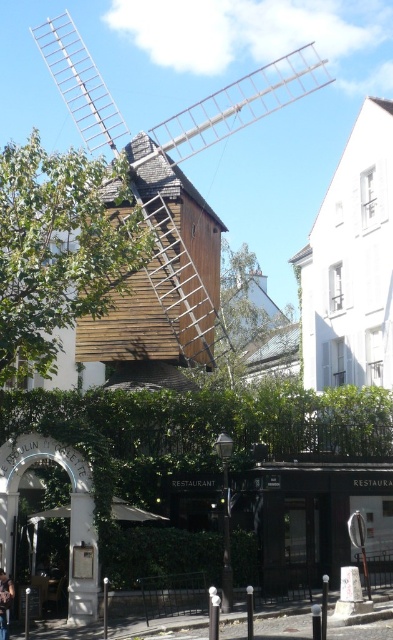
You are standing in front of the windmill and notice two points marked on the structure. The first point is at coordinate point (260, 68) and the second is at coordinate point (9, 612). Which point is closer to you?

Point (9, 612) is closer to you because it is less further to the camera than point (260, 68).

You are standing at the point labeled point (238, 104) in the image. What structure are you directly facing?

The point labeled point (238, 104) corresponds to the wooden windmill at center, so you are directly facing the wooden windmill at center.

You are an architect planning to install a new structure in the area. You have a design that requires the width of the wooden windmill at center to be smaller than the dark brown leather jacket at lower left. Is this feasible based on the current scene?

The wooden windmill at center is wider than the dark brown leather jacket at lower left, so the proposed design requiring the windmill to be smaller is not feasible with the current dimensions.